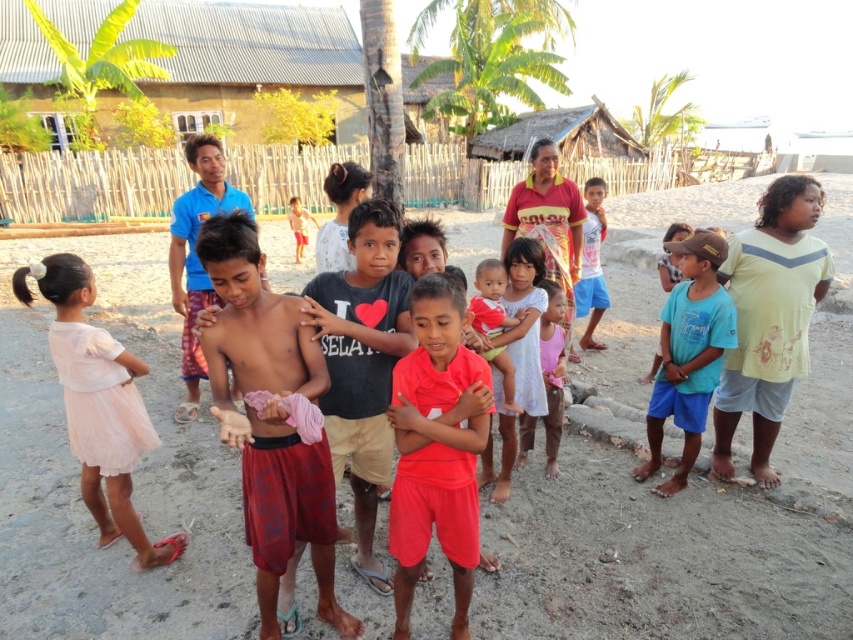
You are a photographer trying to capture a photo of the pink tulle dress at lower left. The camera you are using has a very narrow field of view. To ensure the dress is centered in your shot, where should you aim your camera? Please provide coordinates based on the image grid system where the bottom left corner is 0,0 and the top right corner is 1,1.

You should aim your camera at point (x=97, y=404) to center the pink tulle dress at lower left in your shot.

You are a photographer trying to capture a group photo of the children. The two main subjects are the dark gray cotton shirt at center and the pink fabric dress at center. Which of these two should you focus on first if you want to ensure both are in frame and properly sized?

The dark gray cotton shirt at center is larger in size than the pink fabric dress at center, so you should focus on the dark gray cotton shirt at center first to ensure proper framing for both subjects.